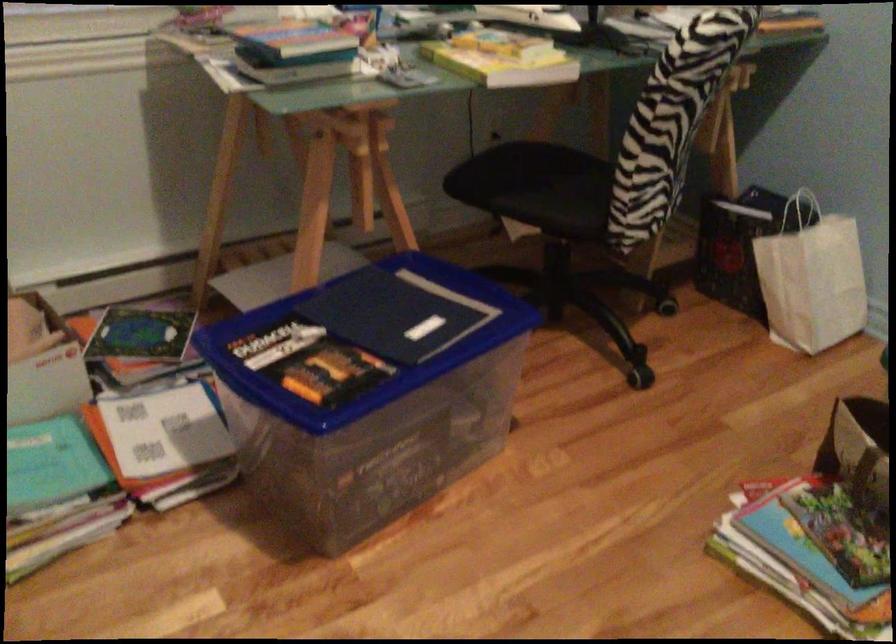
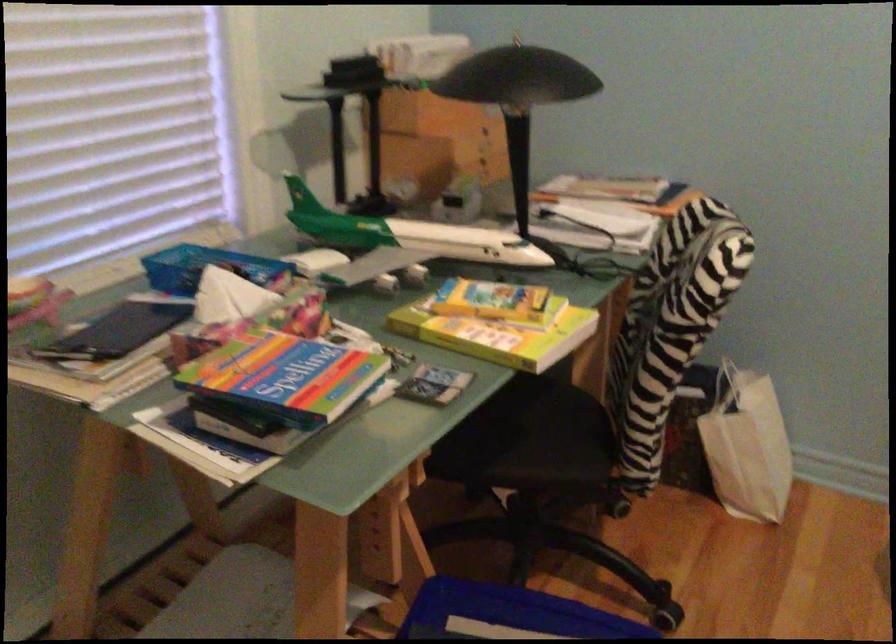
Locate, in the second image, the point that corresponds to (x=444, y=281) in the first image.

(507, 614)